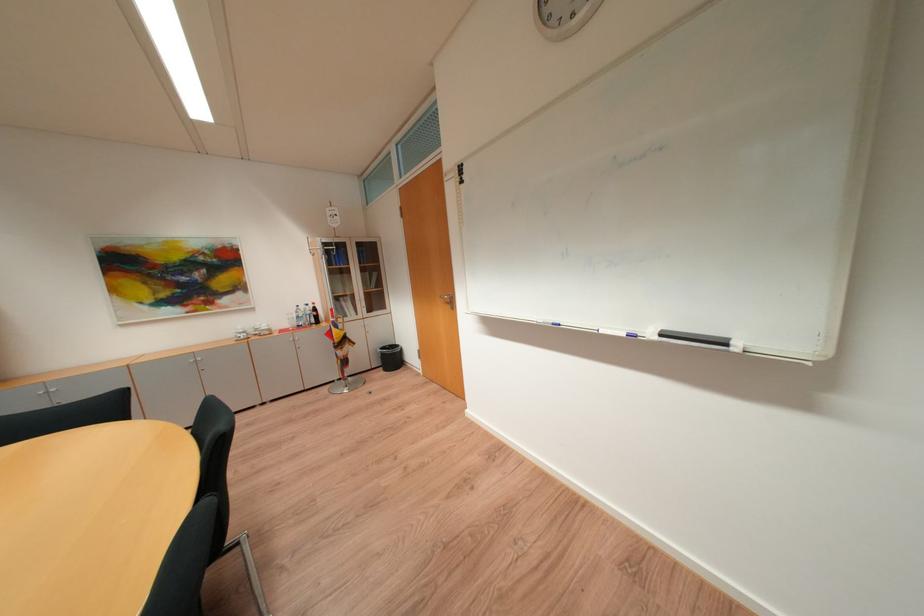
This screenshot has width=924, height=616. What are the coordinates of `chair sitting surface` in the screenshot? It's located at (254, 531).